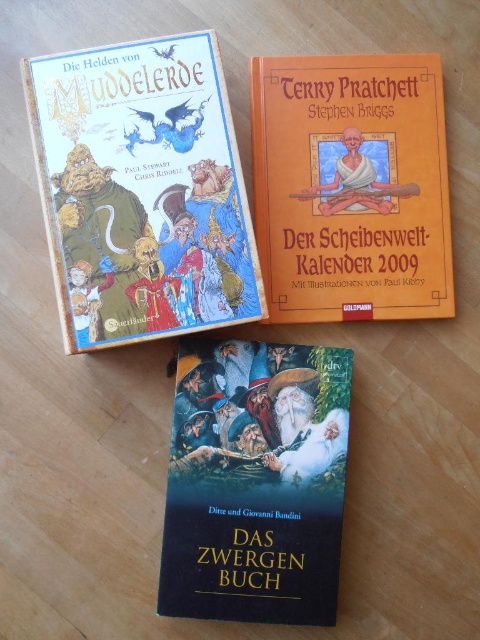
Question: Does matte paper book at upper left appear on the right side of dark blue matte book at center?

Choices:
 (A) no
 (B) yes

Answer: (A)

Question: Can you confirm if brown leather book at upper center is smaller than dark blue matte book at center?

Choices:
 (A) yes
 (B) no

Answer: (A)

Question: Among these points, which one is nearest to the camera?

Choices:
 (A) (175, 67)
 (B) (214, 449)

Answer: (A)

Question: Among these objects, which one is farthest from the camera?

Choices:
 (A) dark blue matte book at center
 (B) matte paper book at upper left
 (C) brown leather book at upper center

Answer: (C)

Question: Estimate the real-world distances between objects in this image. Which object is closer to the matte paper book at upper left?

Choices:
 (A) brown leather book at upper center
 (B) dark blue matte book at center

Answer: (A)

Question: Considering the relative positions of brown leather book at upper center and dark blue matte book at center in the image provided, where is brown leather book at upper center located with respect to dark blue matte book at center?

Choices:
 (A) above
 (B) below

Answer: (A)